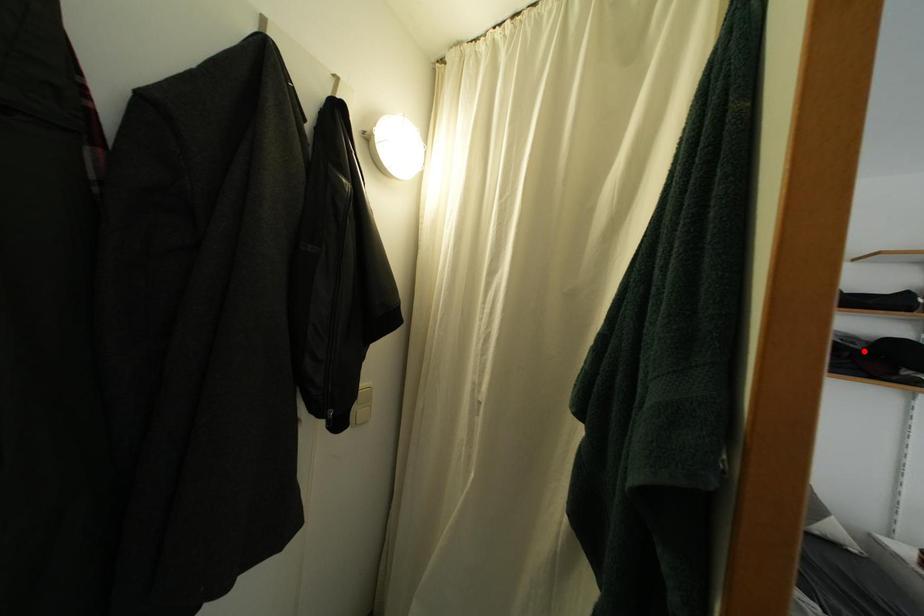
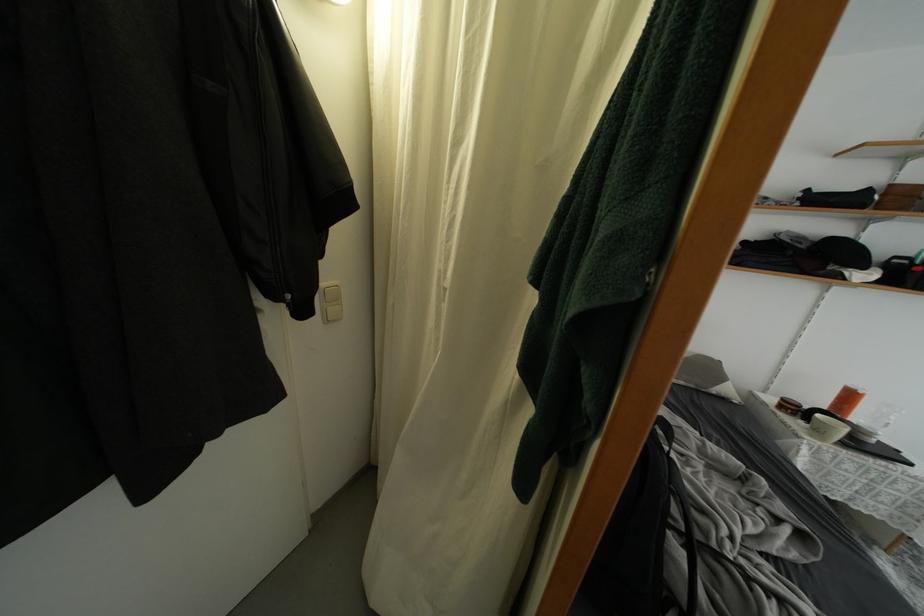
The point at the highlighted location is marked in the first image. Where is the corresponding point in the second image?

(808, 251)